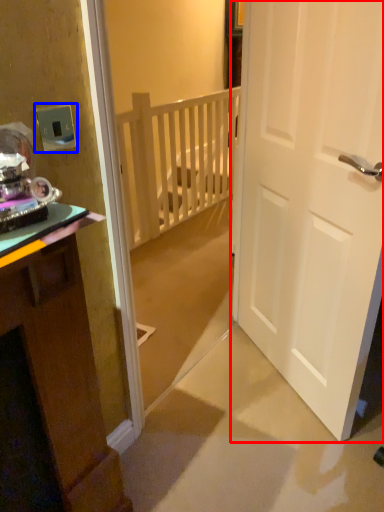
Question: Which of the following is the closest to the observer, door (highlighted by a red box) or electric outlet (highlighted by a blue box)?

Choices:
 (A) door
 (B) electric outlet

Answer: (A)